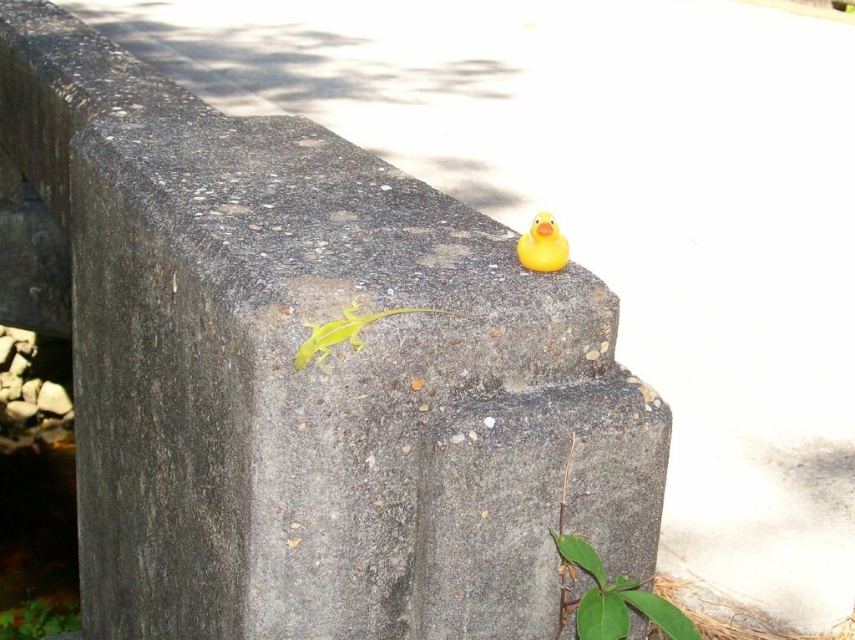
You are standing in front of a concrete structure and see a smooth green lizard at center and a bright yellow rubber duck on the right. Which object is closer to the edge of the concrete structure?

The bright yellow rubber duck on the right is closer to the edge of the concrete structure because it is positioned near the edge, while the smooth green lizard at center is located at point (x=346, y=332) which is further from the edge.